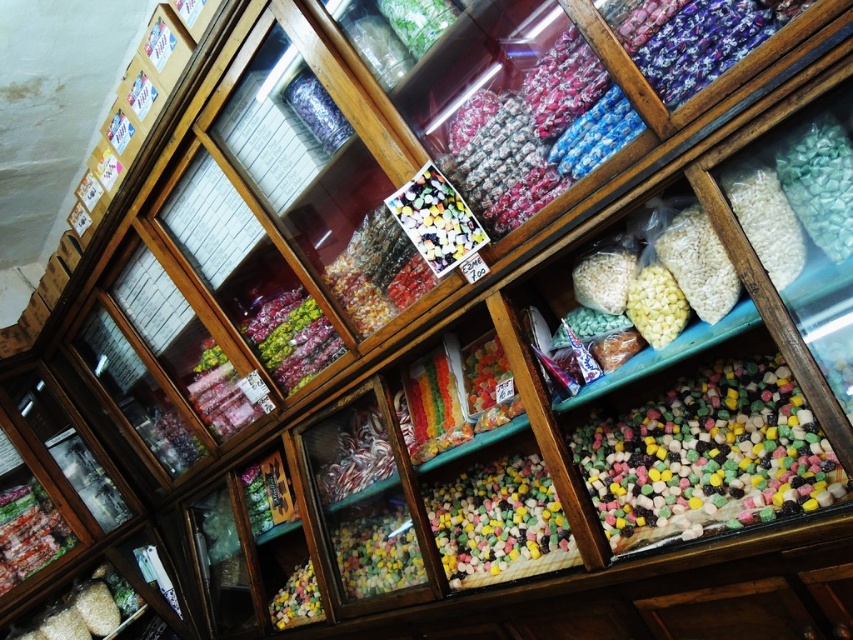
Looking at this image, you are a customer trying to reach both the white matte rice at right and the translucent plastic candy at lower center in the display case. If you can only extend your hand 1.5 meters, can you reach both items without moving your position?

The white matte rice at right and the translucent plastic candy at lower center are 2.21 meters apart from each other. Since your hand can only extend 1.5 meters, you cannot reach both items without moving your position.

You are a customer looking at the display case. You see a point marked at coordinates (376, 548). What is located at that point?

The point at coordinates (376, 548) corresponds to the multicolored glossy candy at center.

You are a customer looking at the display case and want to know if the candy at point (724,188) is closer to you than the candy at point (312,573). Can you determine this based on their positions?

Yes, the candy at point (724,188) is closer to you than the candy at point (312,573) because it is positioned in front of it according to the coordinates provided.